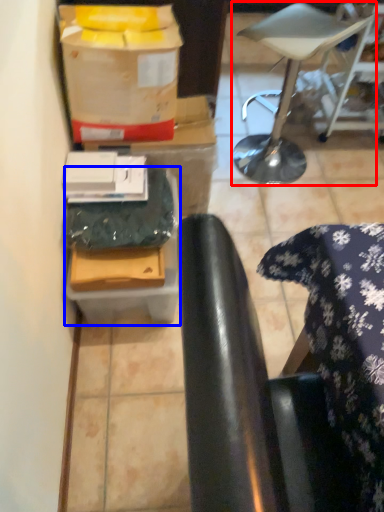
Question: Which object appears closest to the camera in this image, furniture (highlighted by a red box) or cardboard box (highlighted by a blue box)?

Choices:
 (A) furniture
 (B) cardboard box

Answer: (B)